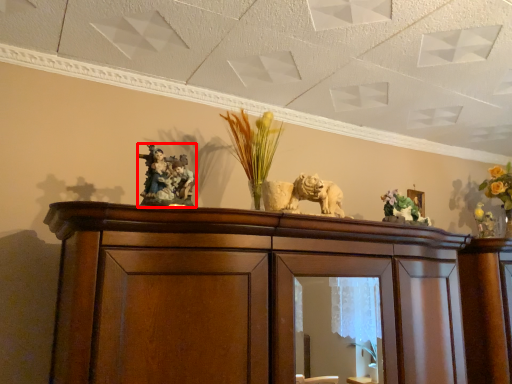
Question: From the image's perspective, what is the correct spatial positioning of animal (annotated by the red box) in reference to floral arrangement?

Choices:
 (A) above
 (B) below

Answer: (A)